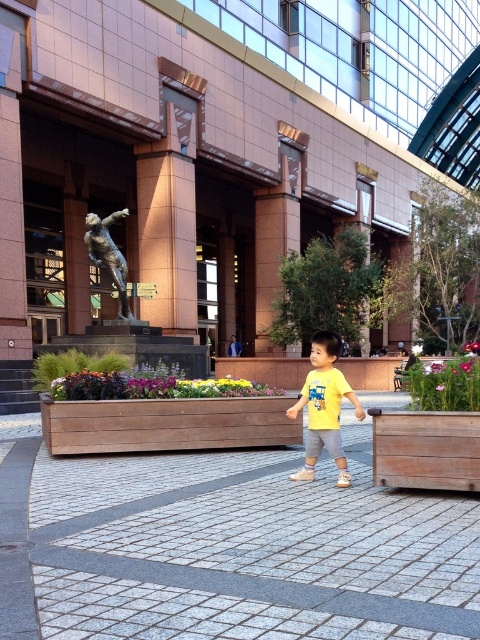
You are standing in the urban outdoor scene described. You want to locate the brown stone mall at center. According to the coordinates provided, where exactly would you find it?

The brown stone mall at center is located at coordinates point (x=202, y=150).

You are a city planner designing a new public space. You want to place a new bench between the brown stone mall at center and the gray concrete pavement at center. Given that the bench requires 120 feet of space between these two landmarks to be placed safely, will there be enough space?

The brown stone mall at center is 118.13 feet from the gray concrete pavement at center. Since the required space is 120 feet, there is insufficient space to place the bench safely.

You are standing in the urban outdoor scene and want to take a photo of both the brown stone mall at center and the sandy beige stone statue at upper center. Which object should you focus on first to ensure both are in the frame?

You should focus on the brown stone mall at center first because it is closer to the viewer than the sandy beige stone statue at upper center, allowing both to be in the frame by adjusting the camera angle.